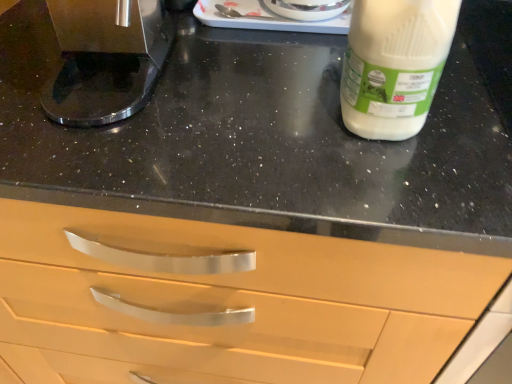
Find the location of a particular element. free space between white plastic bottle at upper right and shiny metallic coffee machine at left is located at coordinates (257, 82).